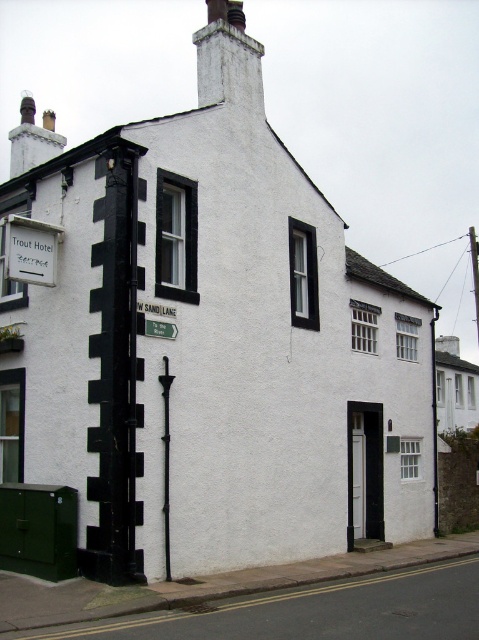
You are a tourist holding a map that says you need to find the black metal pole at center and the green plastic street sign at lower left. The map also mentions that one of them is larger. Without looking at the map, can you determine which object is larger based on your current view?

The black metal pole at center is bigger than the green plastic street sign at lower left, so the larger object is the black metal pole at center.

You are standing on the street in front of the Trout Hotel. You see a white painted brick chimney at upper center and a black metal pole at center. Which object is positioned to the left when facing the building?

The white painted brick chimney at upper center is to the left of the black metal pole at center when facing the building.

You are standing on the street in front of the Trout Hotel. You notice a white painted brick chimney at upper center and a black metal pole at center. Which object is closer to you?

The white painted brick chimney at upper center is closer to you because it is further to the viewer than the black metal pole at center.